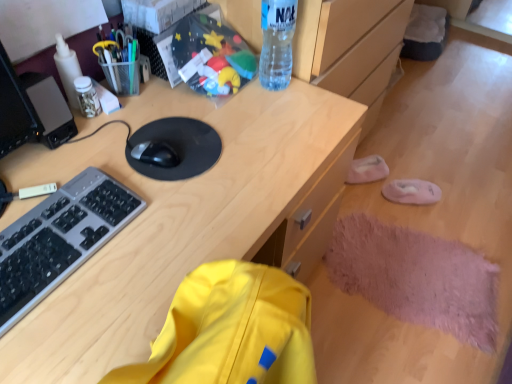
Where is `vacant space to the right of white plastic bottle at upper left, which ranks as the first bottle in left-to-right order`? This screenshot has height=384, width=512. vacant space to the right of white plastic bottle at upper left, which ranks as the first bottle in left-to-right order is located at coordinates (146, 104).